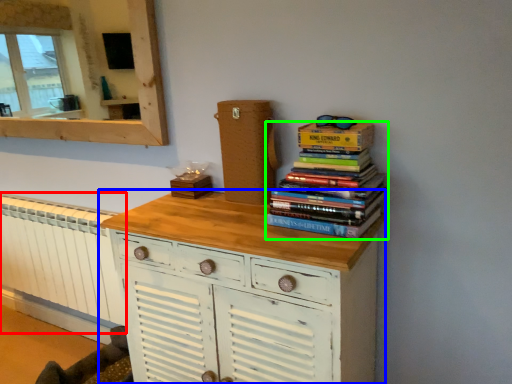
Question: Estimate the real-world distances between objects in this image. Which object is farther from radiator (highlighted by a red box), chest of drawers (highlighted by a blue box) or book (highlighted by a green box)?

Choices:
 (A) chest of drawers
 (B) book

Answer: (B)